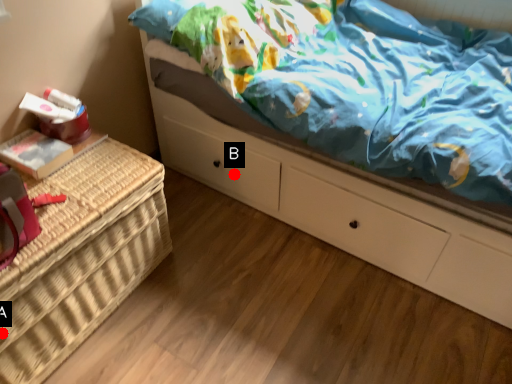
Question: Two points are circled on the image, labeled by A and B beside each circle. Which point is farther to the camera?

Choices:
 (A) A is further
 (B) B is further

Answer: (B)